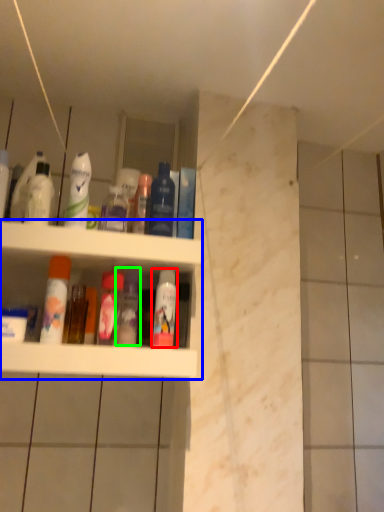
Question: Which object is positioned closest to mouthwash (highlighted by a red box)? Select from shelf (highlighted by a blue box) and toiletry (highlighted by a green box).

Choices:
 (A) shelf
 (B) toiletry

Answer: (B)